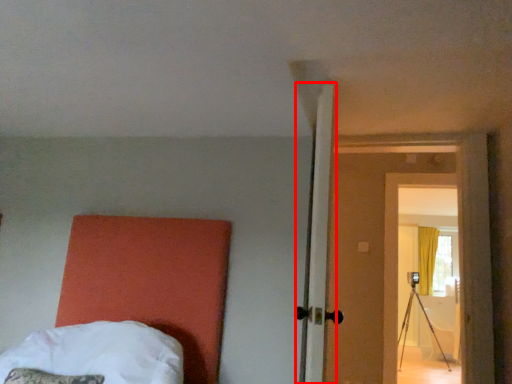
Question: In this image, where is door (annotated by the red box) located relative to bed?

Choices:
 (A) right
 (B) left

Answer: (A)